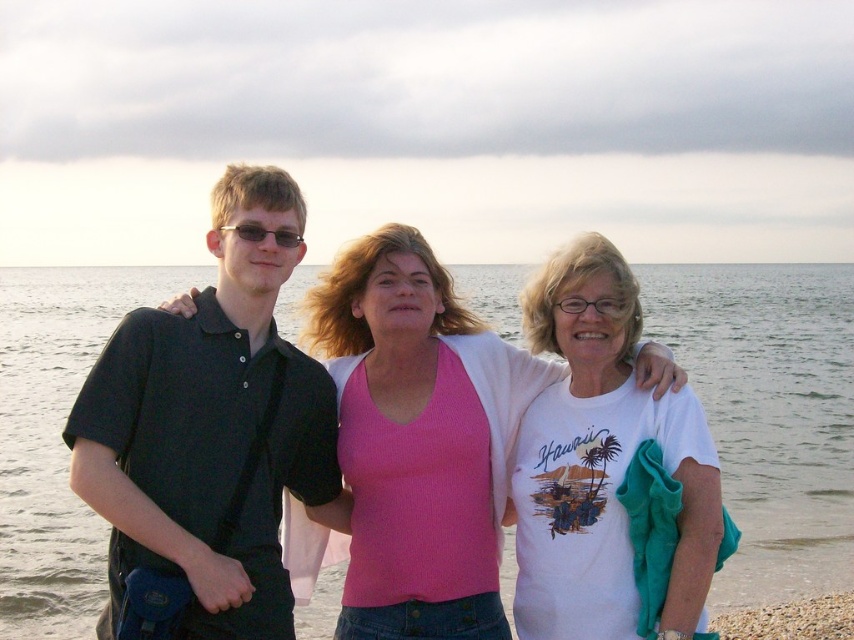
Who is positioned more to the left, clear water at center or pink ribbed tank top at center?

pink ribbed tank top at center

Is clear water at center closer to the viewer compared to pink ribbed tank top at center?

Yes, clear water at center is closer to the viewer.

Which is behind, point (502, 572) or point (447, 499)?

Positioned behind is point (502, 572).

This screenshot has width=854, height=640. Identify the location of clear water at center. (770, 412).

Measure the distance between black matte shirt at left and camera.

The distance of black matte shirt at left from camera is 10.59 meters.

How far apart are black matte shirt at left and white cotton shirt at center?

black matte shirt at left is 3.87 meters from white cotton shirt at center.

At what (x,y) coordinates should I click in order to perform the action: click on black matte shirt at left. Please return your answer as a coordinate pair (x, y). The image size is (854, 640). Looking at the image, I should click on (212, 426).

Is clear water at center positioned behind black matte shirt at left?

Yes.

Is clear water at center taller than black matte shirt at left?

Correct, clear water at center is much taller as black matte shirt at left.

Is point (752, 600) positioned behind point (227, 342)?

Yes, point (752, 600) is farther from viewer.

Where is `clear water at center`? clear water at center is located at coordinates (770, 412).